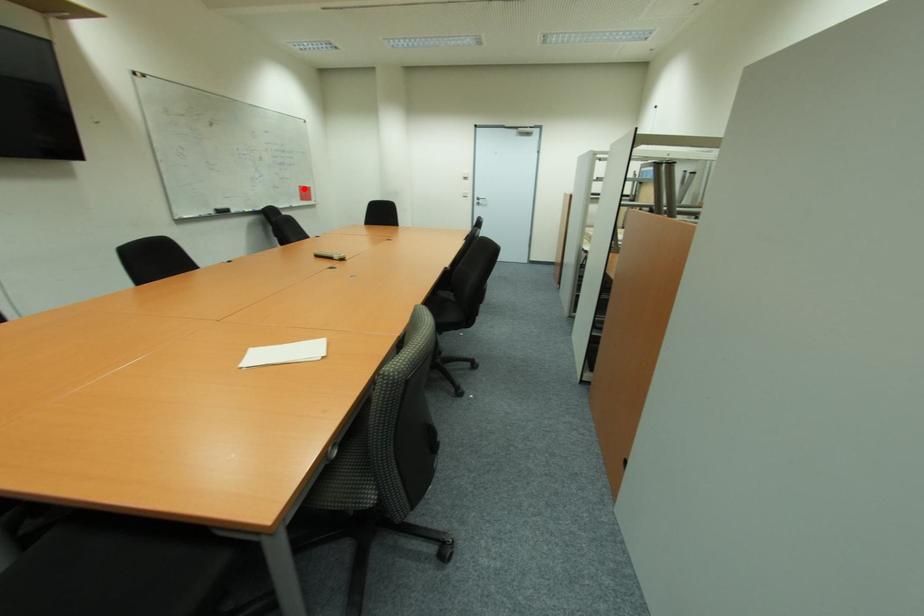
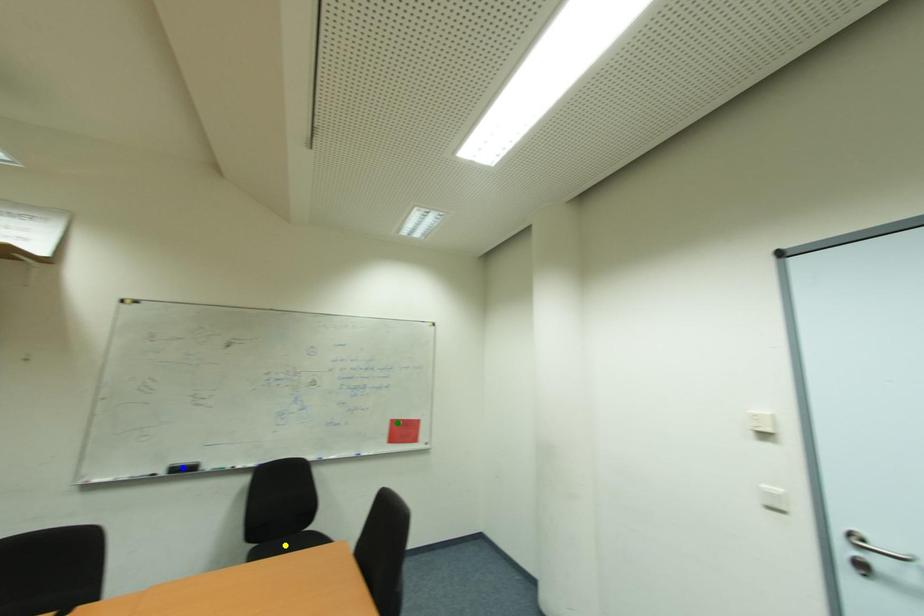
Question: I am providing you with two images of the same scene from different viewpoints. A red point is marked on the first image. You are given multiple points on the second image. Which spot in image 2 lines up with the point in image 1?

Choices:
 (A) blue point
 (B) yellow point
 (C) green point

Answer: (C)